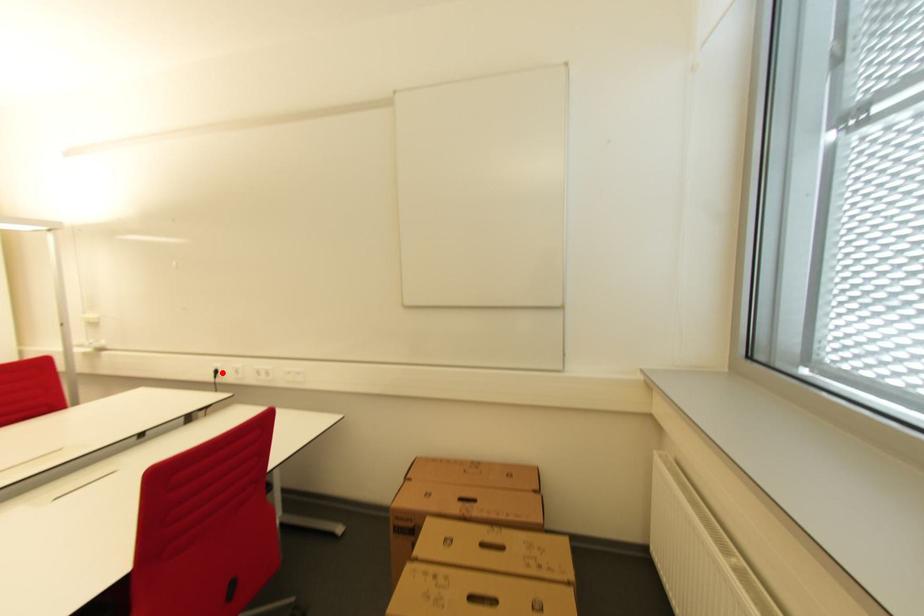
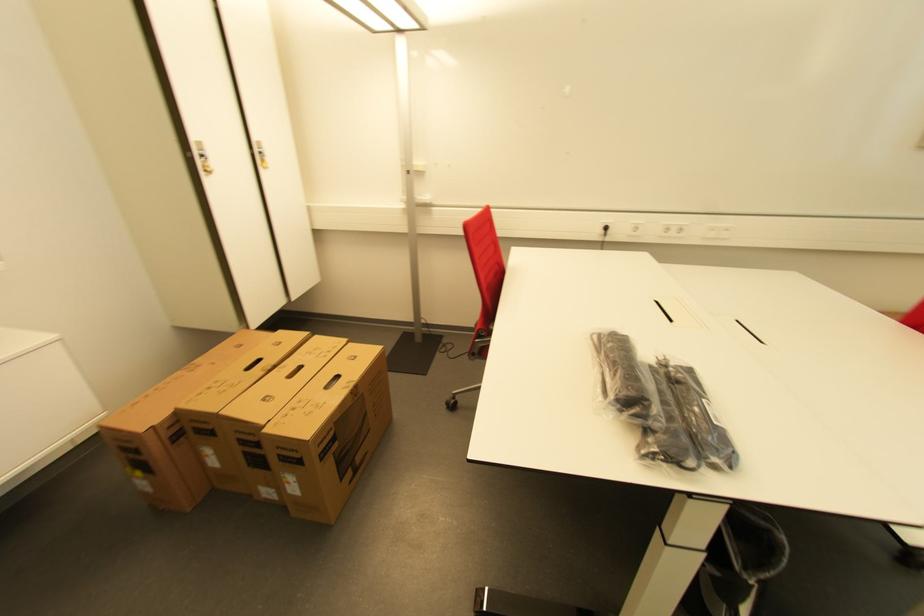
Where in the second image is the point corresponding to the highlighted location from the first image?

(611, 230)